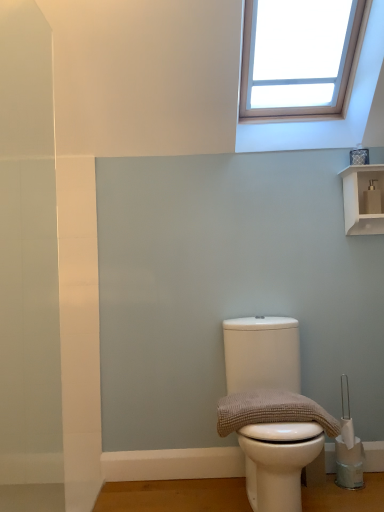
Question: From the image's perspective, would you say white glossy shelf at upper right is shown under brown textured towel at center?

Choices:
 (A) yes
 (B) no

Answer: (B)

Question: Is white glossy shelf at upper right wider than brown textured towel at center?

Choices:
 (A) yes
 (B) no

Answer: (B)

Question: Does white glossy shelf at upper right touch brown textured towel at center?

Choices:
 (A) yes
 (B) no

Answer: (B)

Question: Does white glossy shelf at upper right have a smaller size compared to brown textured towel at center?

Choices:
 (A) no
 (B) yes

Answer: (B)

Question: Can you confirm if white glossy shelf at upper right is positioned to the right of brown textured towel at center?

Choices:
 (A) yes
 (B) no

Answer: (A)

Question: Is point (264, 445) closer or farther from the camera than point (284, 415)?

Choices:
 (A) closer
 (B) farther

Answer: (A)

Question: From the image's perspective, is white matte toilet at center positioned above or below brown textured towel at center?

Choices:
 (A) above
 (B) below

Answer: (B)

Question: Is white matte toilet at center taller or shorter than brown textured towel at center?

Choices:
 (A) short
 (B) tall

Answer: (B)

Question: Is white matte toilet at center wider or thinner than brown textured towel at center?

Choices:
 (A) wide
 (B) thin

Answer: (A)

Question: From the image's perspective, is white glossy shelf at upper right located above or below brown textured towel at center?

Choices:
 (A) below
 (B) above

Answer: (B)

Question: In the image, is white glossy shelf at upper right positioned in front of or behind brown textured towel at center?

Choices:
 (A) front
 (B) behind

Answer: (B)

Question: Looking at their shapes, would you say white glossy shelf at upper right is wider or thinner than brown textured towel at center?

Choices:
 (A) wide
 (B) thin

Answer: (B)

Question: Considering the positions of white glossy shelf at upper right and brown textured towel at center in the image, is white glossy shelf at upper right taller or shorter than brown textured towel at center?

Choices:
 (A) short
 (B) tall

Answer: (B)

Question: Considering the positions of point (240, 347) and point (360, 178), is point (240, 347) closer or farther from the camera than point (360, 178)?

Choices:
 (A) closer
 (B) farther

Answer: (A)

Question: In the image, is white matte toilet at center positioned in front of or behind white glossy shelf at upper right?

Choices:
 (A) behind
 (B) front

Answer: (B)